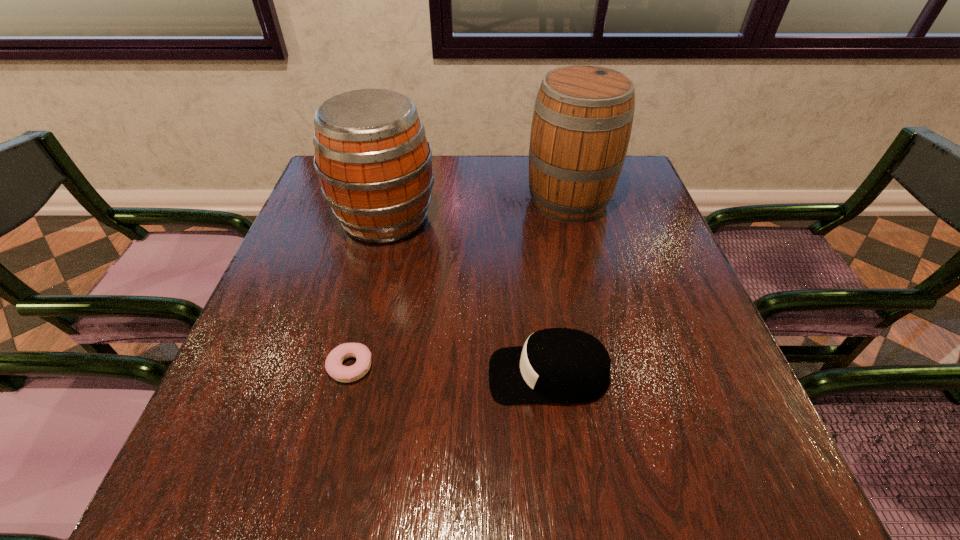
What are the coordinates of `object that is positioned at the left edge` in the screenshot? It's located at (373, 160).

You are a GUI agent. You are given a task and a screenshot of the screen. Output one action in this format:
    pyautogui.click(x=<x>, y=<y>)
    Task: Click on the object that is at the right edge
    The height and width of the screenshot is (540, 960).
    Given the screenshot: What is the action you would take?
    pyautogui.click(x=582, y=121)

You are a GUI agent. You are given a task and a screenshot of the screen. Output one action in this format:
    pyautogui.click(x=<x>, y=<y>)
    Task: Click on the object that is positioned at the far left corner
    The width and height of the screenshot is (960, 540).
    Given the screenshot: What is the action you would take?
    pyautogui.click(x=373, y=160)

Locate an element on the screen. Image resolution: width=960 pixels, height=540 pixels. object that is positioned at the far right corner is located at coordinates (582, 121).

The width and height of the screenshot is (960, 540). What are the coordinates of `blank space at the far edge` in the screenshot? It's located at (499, 194).

You are a GUI agent. You are given a task and a screenshot of the screen. Output one action in this format:
    pyautogui.click(x=<x>, y=<y>)
    Task: Click on the free space at the left edge of the desktop
    
    Given the screenshot: What is the action you would take?
    (347, 264)

The height and width of the screenshot is (540, 960). What are the coordinates of `vacant position at the right edge of the desktop` in the screenshot? It's located at (711, 353).

The width and height of the screenshot is (960, 540). In order to click on vacant area at the near left corner in this screenshot , I will do `click(204, 496)`.

This screenshot has height=540, width=960. In the image, there is a desktop. Find the location of `vacant space at the far right corner`. vacant space at the far right corner is located at coordinates (639, 175).

This screenshot has height=540, width=960. Find the location of `vacant region at the near right corner of the desktop`. vacant region at the near right corner of the desktop is located at coordinates (744, 495).